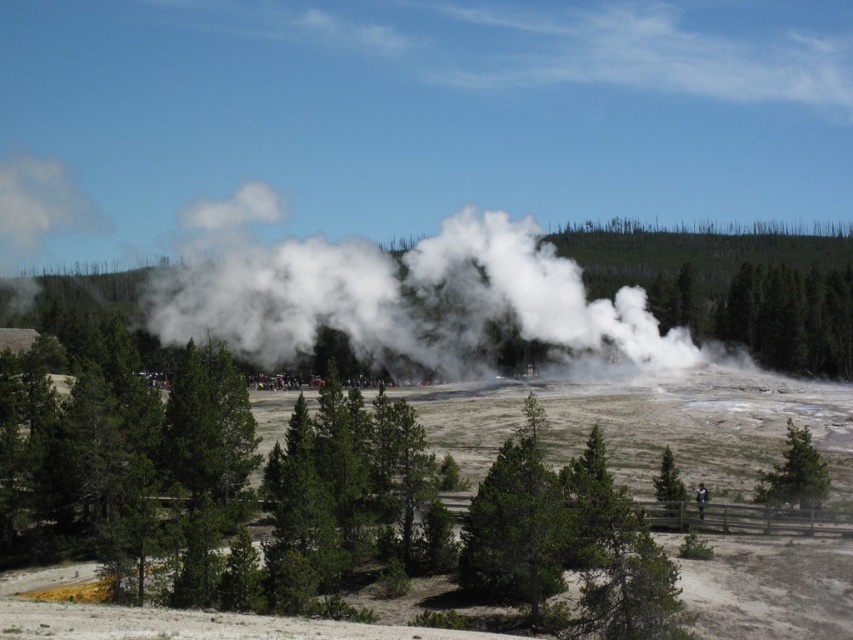
Between point (793, 472) and point (680, 484), which one is positioned behind?

The point (680, 484) is more distant.

Is green matte tree at lower right below green matte tree at center?

Yes.

Does point (807, 483) come in front of point (666, 500)?

Yes.

I want to click on green matte tree at lower right, so click(795, 474).

Can you confirm if white vapor steam at center is positioned below green matte tree at center?

Actually, white vapor steam at center is above green matte tree at center.

Locate an element on the screen. This screenshot has width=853, height=640. white vapor steam at center is located at coordinates (399, 296).

Is point (498, 244) closer to camera compared to point (804, 435)?

No, it is behind (804, 435).

Locate an element on the screen. The width and height of the screenshot is (853, 640). white vapor steam at center is located at coordinates (399, 296).